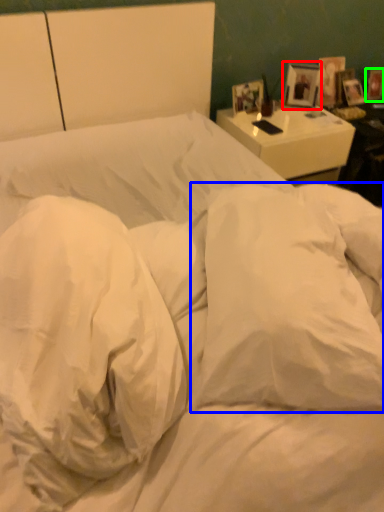
Question: Which object is the farthest from picture frame (highlighted by a red box)? Choose among these: pillow (highlighted by a blue box) or picture frame (highlighted by a green box).

Choices:
 (A) pillow
 (B) picture frame

Answer: (A)